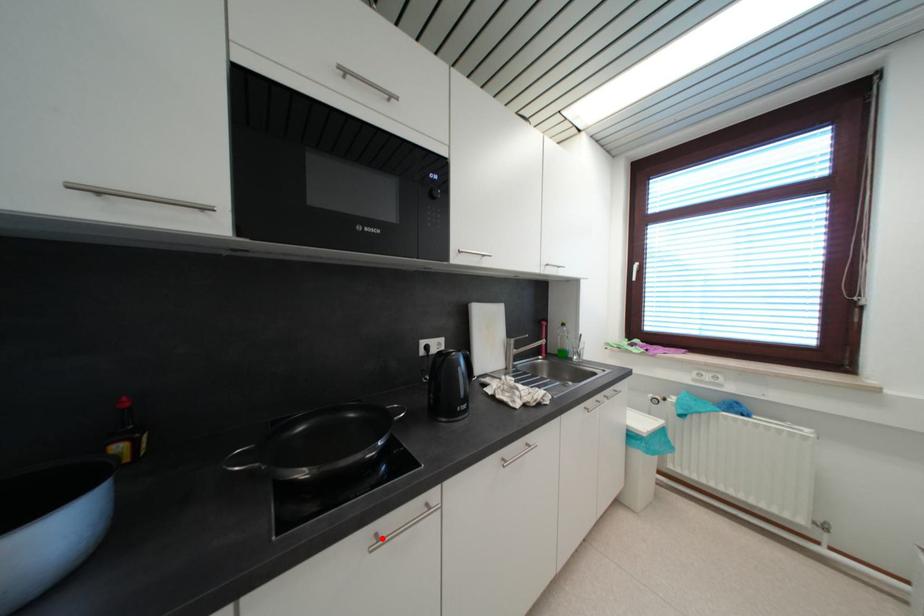
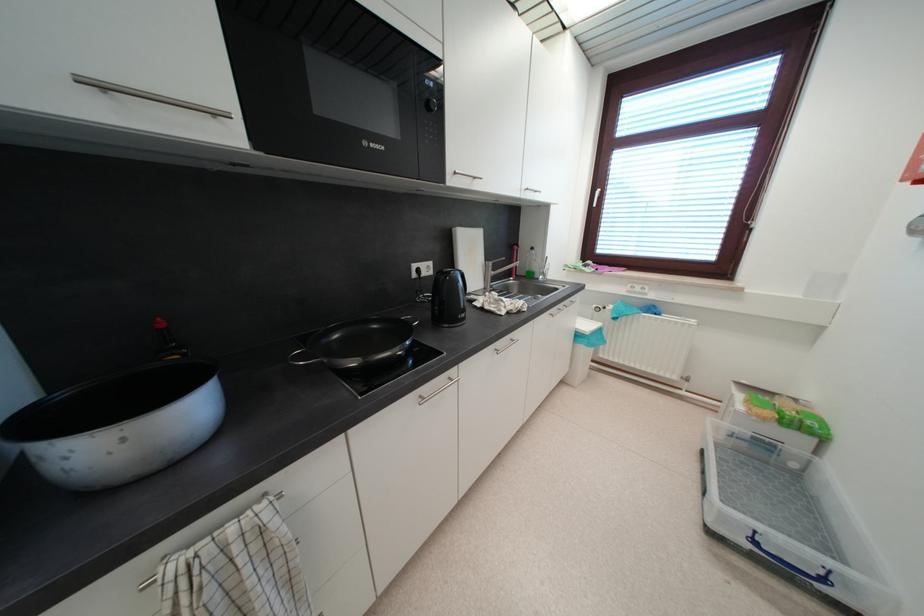
The point at the highlighted location is marked in the first image. Where is the corresponding point in the second image?

(427, 400)